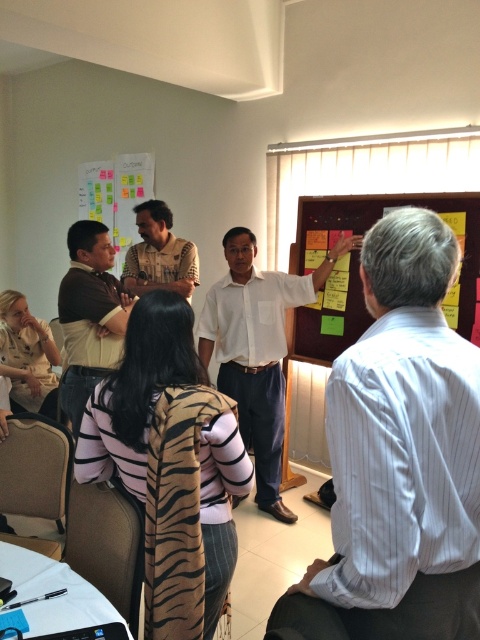
Locate an element on the screen. The height and width of the screenshot is (640, 480). white striped shirt at center is located at coordinates (398, 458).

Which is behind, point (374, 275) or point (215, 323)?

The point (215, 323) is more distant.

At what (x,y) coordinates should I click in order to perform the action: click on white striped shirt at center. Please return your answer as a coordinate pair (x, y). The image size is (480, 640). Looking at the image, I should click on click(x=398, y=458).

Can you confirm if wooden bulletin board at center is positioned to the left of matte brown shirt at center?

Incorrect, wooden bulletin board at center is not on the left side of matte brown shirt at center.

Which is above, wooden bulletin board at center or matte brown shirt at center?

matte brown shirt at center is higher up.

Between point (468, 232) and point (149, 276), which one is positioned behind?

Positioned behind is point (149, 276).

Find the location of a particular element. wooden bulletin board at center is located at coordinates (380, 216).

Does wooden bulletin board at center appear under brown leather jacket at center?

Actually, wooden bulletin board at center is above brown leather jacket at center.

Is point (332, 353) closer to viewer compared to point (71, 300)?

No, (332, 353) is behind (71, 300).

The image size is (480, 640). Identify the location of wooden bulletin board at center. (380, 216).